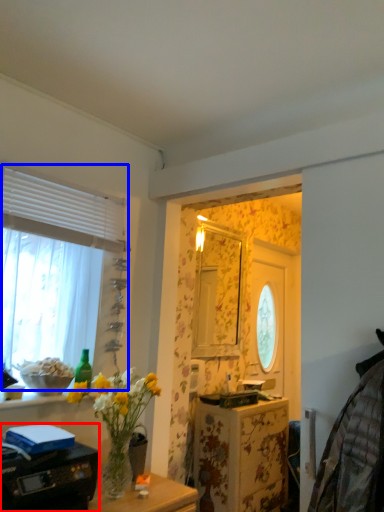
Question: Which of the following is the closest to the observer, printer (highlighted by a red box) or window (highlighted by a blue box)?

Choices:
 (A) printer
 (B) window

Answer: (A)